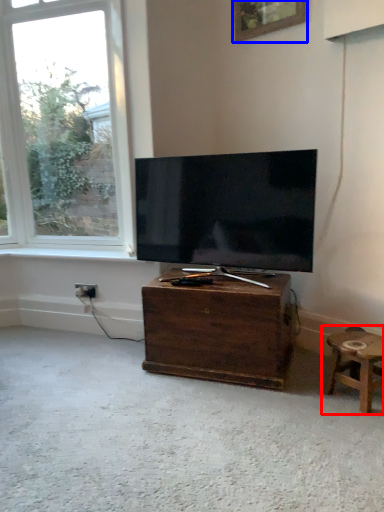
Question: Which object appears farthest to the camera in this image, stool (highlighted by a red box) or picture frame (highlighted by a blue box)?

Choices:
 (A) stool
 (B) picture frame

Answer: (B)